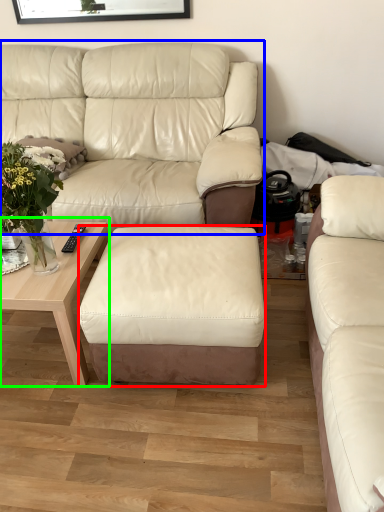
Question: Which is farther away from stool (highlighted by a red box)? studio couch (highlighted by a blue box) or coffee table (highlighted by a green box)?

Choices:
 (A) studio couch
 (B) coffee table

Answer: (A)